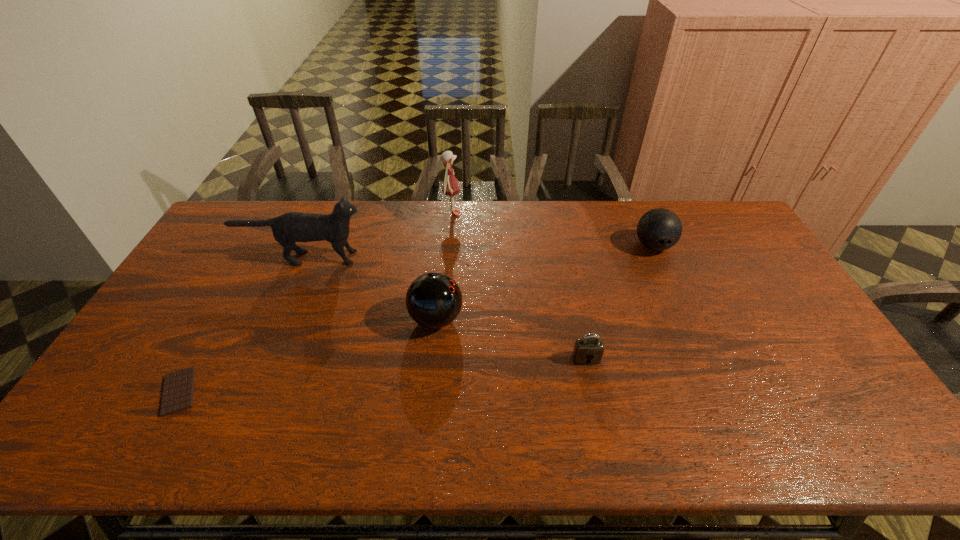
This screenshot has width=960, height=540. In order to click on the farthest object in this screenshot , I will do `click(450, 187)`.

Identify the location of cat. (291, 227).

I want to click on the nearer bowling ball, so (x=433, y=300).

Image resolution: width=960 pixels, height=540 pixels. Find the location of `the left bowling ball`. the left bowling ball is located at coordinates (433, 300).

Identify the location of the right bowling ball. Image resolution: width=960 pixels, height=540 pixels. pyautogui.click(x=659, y=229).

The width and height of the screenshot is (960, 540). What are the coordinates of `the farther bowling ball` in the screenshot? It's located at (659, 229).

This screenshot has width=960, height=540. I want to click on the fifth tallest object, so click(588, 350).

At what (x,y) coordinates should I click in order to perform the action: click on the second nearest object. Please return your answer as a coordinate pair (x, y). Looking at the image, I should click on [588, 350].

The width and height of the screenshot is (960, 540). I want to click on the nearest object, so click(178, 389).

I want to click on the shortest object, so (178, 389).